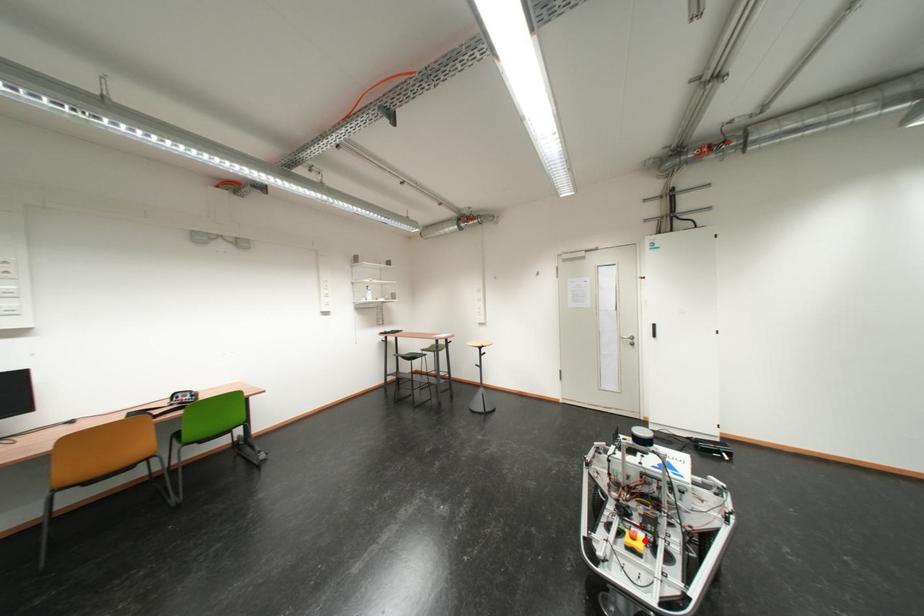
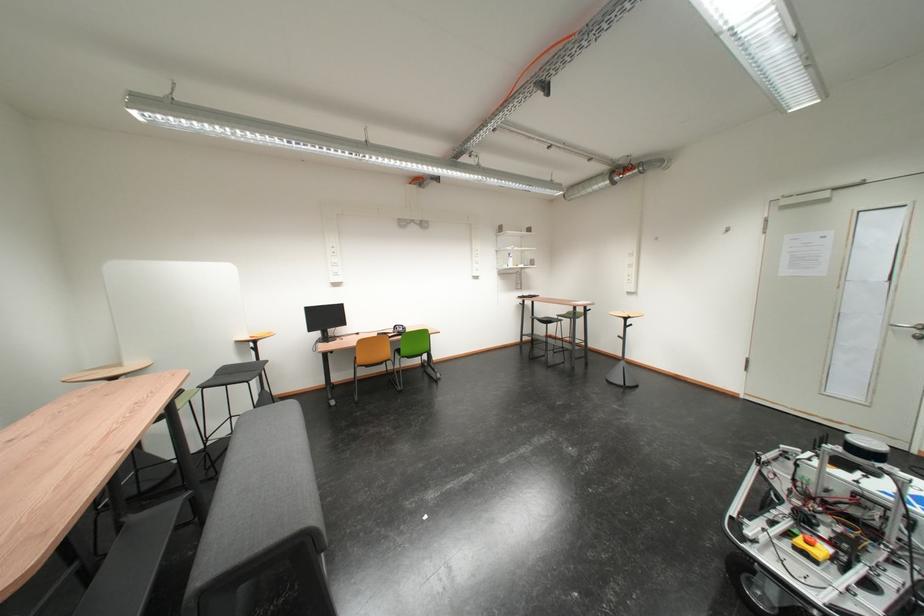
In the second image, find the point that corresponds to the highlighted location in the first image.

(820, 545)